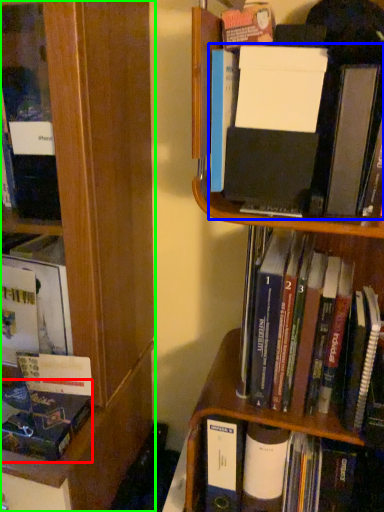
Question: Which object is positioned closest to book (highlighted by a red box)? Select from book (highlighted by a blue box) and bookcase (highlighted by a green box).

Choices:
 (A) book
 (B) bookcase

Answer: (B)